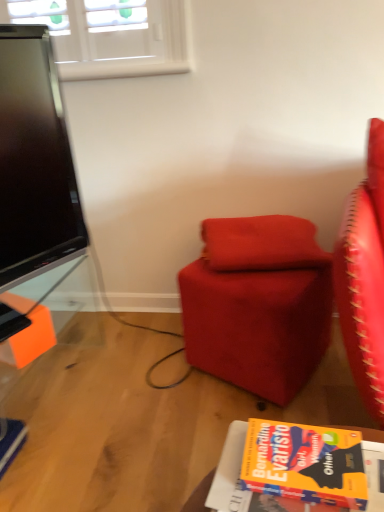
Measure the distance between suede-like red ottoman at center and camera.

1.27 meters.

What do you see at coordinates (258, 304) in the screenshot? The height and width of the screenshot is (512, 384). I see `suede-like red ottoman at center` at bounding box center [258, 304].

What do you see at coordinates (261, 244) in the screenshot? The height and width of the screenshot is (512, 384). I see `velvet red pillow at center` at bounding box center [261, 244].

At what (x,y) coordinates should I click in order to perform the action: click on suede-like red ottoman at center. Please return your answer as a coordinate pair (x, y). Looking at the image, I should click on (258, 304).

Could you tell me if suede-like red ottoman at center is turned towards velvet red pillow at center?

No, suede-like red ottoman at center does not turn towards velvet red pillow at center.

From the image's perspective, which is below, suede-like red ottoman at center or velvet red pillow at center?

suede-like red ottoman at center, from the image's perspective.

From a real-world perspective, which object rests below the other?

suede-like red ottoman at center, from a real-world perspective.

Is suede-like red ottoman at center to the right of velvet red pillow at center from the viewer's perspective?

No.

From a real-world perspective, which object rests below the other?

orange matte book at lower right.

Is velvet red pillow at center wider or thinner than orange matte book at lower right?

velvet red pillow at center is wider than orange matte book at lower right.

Which of these two, velvet red pillow at center or orange matte book at lower right, stands taller?

velvet red pillow at center.

Does velvet red pillow at center come behind orange matte book at lower right?

Yes, velvet red pillow at center is further from the camera.

Would you say velvet red pillow at center is to the left or to the right of suede-like red ottoman at center in the picture?

velvet red pillow at center is to the right of suede-like red ottoman at center.

In the scene shown: Could you tell me if velvet red pillow at center is facing suede-like red ottoman at center?

No, velvet red pillow at center is not aimed at suede-like red ottoman at center.

Considering the sizes of velvet red pillow at center and suede-like red ottoman at center in the image, is velvet red pillow at center wider or thinner than suede-like red ottoman at center?

In the image, velvet red pillow at center appears to be more narrow than suede-like red ottoman at center.

From a real-world perspective, is velvet red pillow at center over suede-like red ottoman at center?

Indeed, from a real-world perspective, velvet red pillow at center stands above suede-like red ottoman at center.

Between orange matte book at lower right and velvet red pillow at center, which one has less height?

Standing shorter between the two is orange matte book at lower right.

Is orange matte book at lower right at the left side of velvet red pillow at center?

→ Yes, orange matte book at lower right is to the left of velvet red pillow at center.

Considering the points (287, 452) and (264, 252), which point is behind, point (287, 452) or point (264, 252)?

The point (264, 252) is farther.

From the image's perspective, does orange matte book at lower right appear higher than suede-like red ottoman at center?

Incorrect, from the image's perspective, orange matte book at lower right is lower than suede-like red ottoman at center.

Is orange matte book at lower right to the right of suede-like red ottoman at center from the viewer's perspective?

No.

From a real-world perspective, is orange matte book at lower right physically below suede-like red ottoman at center?

No, from a real-world perspective, orange matte book at lower right is not below suede-like red ottoman at center.

In the image, is suede-like red ottoman at center on the left side or the right side of orange matte book at lower right?

suede-like red ottoman at center is positioned on orange matte book at lower right's right side.

Considering the relative sizes of suede-like red ottoman at center and orange matte book at lower right in the image provided, is suede-like red ottoman at center thinner than orange matte book at lower right?

In fact, suede-like red ottoman at center might be wider than orange matte book at lower right.

You are a GUI agent. You are given a task and a screenshot of the screen. Output one action in this format:
    pyautogui.click(x=<x>, y=<y>)
    Task: Click on the book to the left of suede-like red ottoman at center
    
    Given the screenshot: What is the action you would take?
    pyautogui.click(x=305, y=463)

The width and height of the screenshot is (384, 512). I want to click on chair located below the velvet red pillow at center (from the image's perspective), so click(x=258, y=304).

This screenshot has width=384, height=512. I want to click on book in front of the velvet red pillow at center, so click(x=305, y=463).

Which object lies nearer to the anchor point orange matte book at lower right, velvet red pillow at center or suede-like red ottoman at center?

suede-like red ottoman at center lies closer to orange matte book at lower right than the other object.

Considering their positions, is velvet red pillow at center positioned closer to suede-like red ottoman at center than orange matte book at lower right?

velvet red pillow at center.

Based on their spatial positions, is orange matte book at lower right or suede-like red ottoman at center further from velvet red pillow at center?

orange matte book at lower right.

Which object lies nearer to the anchor point velvet red pillow at center, suede-like red ottoman at center or orange matte book at lower right?

Among the two, suede-like red ottoman at center is located nearer to velvet red pillow at center.

Estimate the real-world distances between objects in this image. Which object is closer to suede-like red ottoman at center, orange matte book at lower right or velvet red pillow at center?

Among the two, velvet red pillow at center is located nearer to suede-like red ottoman at center.

When comparing their distances from orange matte book at lower right, does suede-like red ottoman at center or velvet red pillow at center seem closer?

Among the two, suede-like red ottoman at center is located nearer to orange matte book at lower right.

Locate an element on the screen. chair between orange matte book at lower right and velvet red pillow at center in the front-back direction is located at coordinates (258, 304).